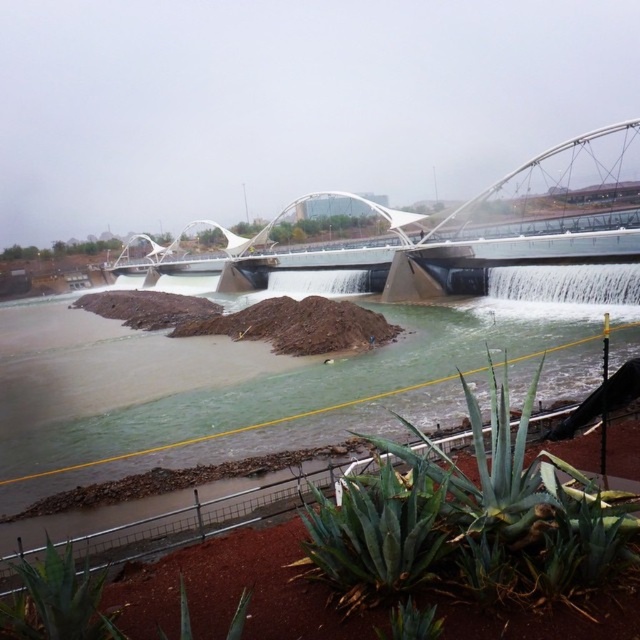
Question: Among these objects, which one is nearest to the camera?

Choices:
 (A) green spiky plant at lower center
 (B) green leafy plant at lower left

Answer: (B)

Question: Estimate the real-world distances between objects in this image. Which object is closer to the green succulent at lower center?

Choices:
 (A) green leafy plant at lower left
 (B) green leafy plant at lower center
 (C) brown sediment at center

Answer: (B)

Question: Is brown sediment at center further to camera compared to green leafy plant at lower left?

Choices:
 (A) no
 (B) yes

Answer: (B)

Question: Which of the following is the closest to the observer?

Choices:
 (A) (269, 355)
 (B) (182, 632)
 (C) (435, 612)
 (D) (579, 520)

Answer: (B)

Question: Does brown sediment at center have a lesser width compared to green leafy plant at lower center?

Choices:
 (A) yes
 (B) no

Answer: (B)

Question: Considering the relative positions of brown sediment at center and green succulent at lower center in the image provided, where is brown sediment at center located with respect to green succulent at lower center?

Choices:
 (A) right
 (B) left

Answer: (B)